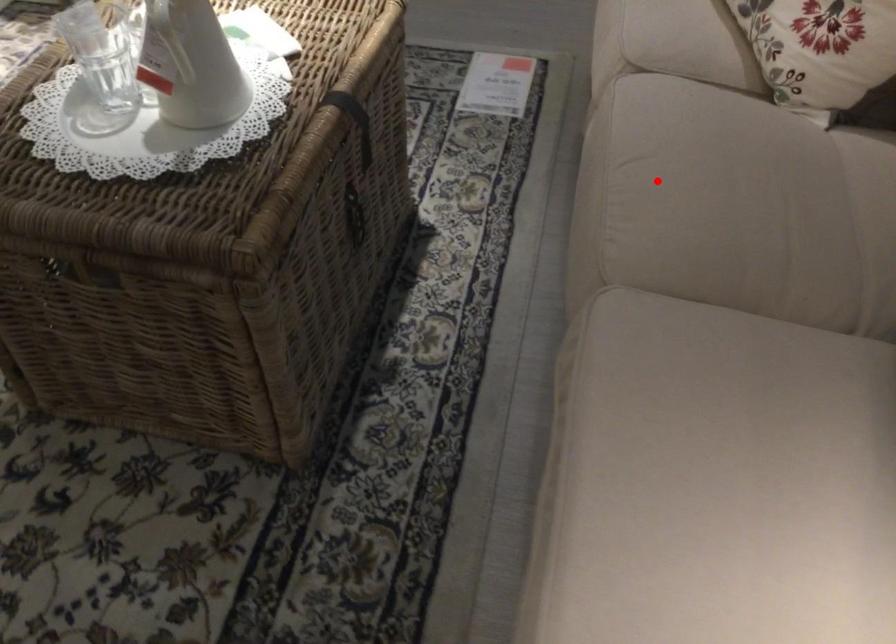
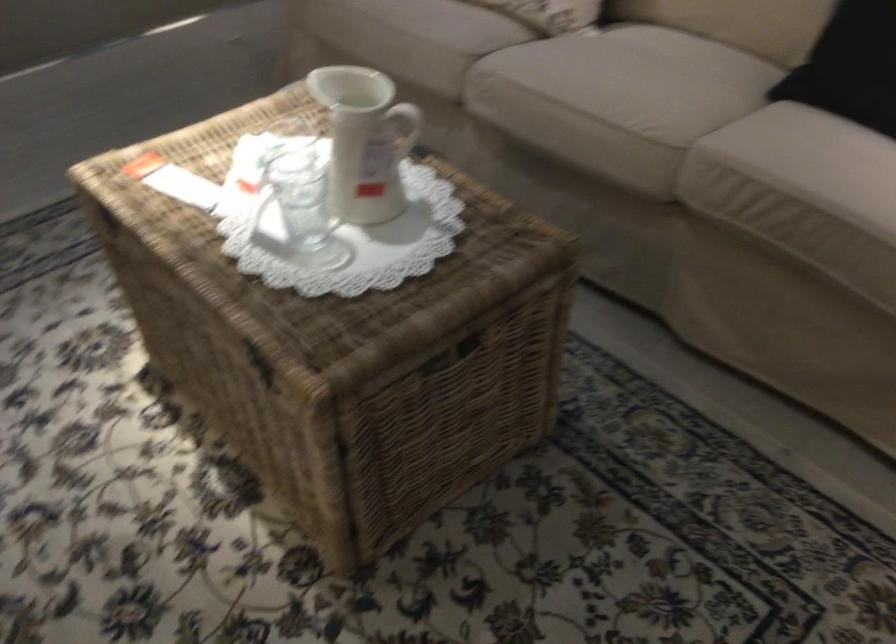
Question: I am providing you with two images of the same scene from different viewpoints. A red point is shown in image1. For the corresponding object point in image2, is it positioned nearer or farther from the camera?

Choices:
 (A) Nearer
 (B) Farther

Answer: (B)